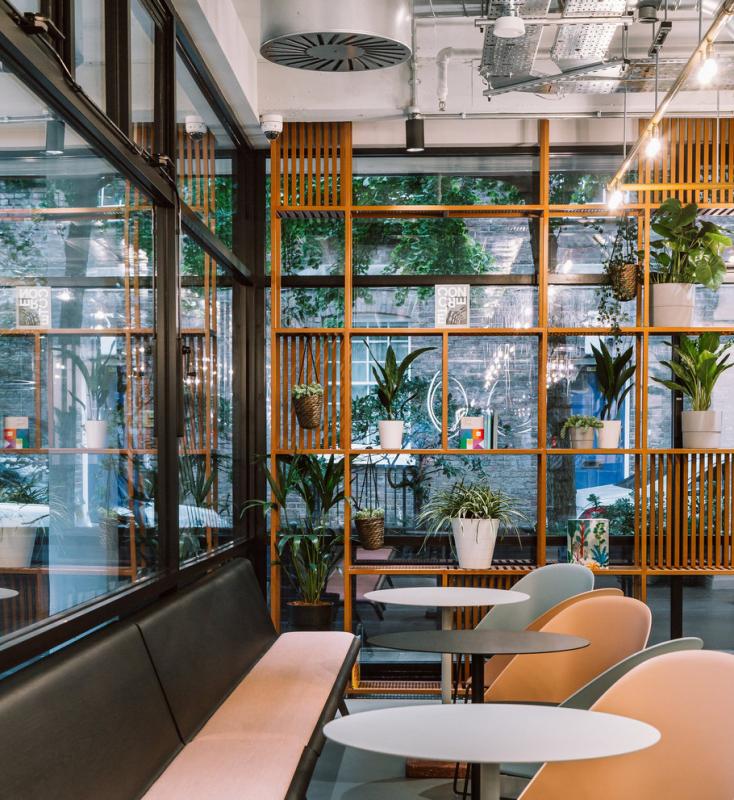
Locate an element on the screen. This screenshot has height=800, width=734. tables and chairs is located at coordinates (443, 745), (482, 646), (459, 602), (555, 574), (605, 590), (608, 609), (669, 646), (680, 672).